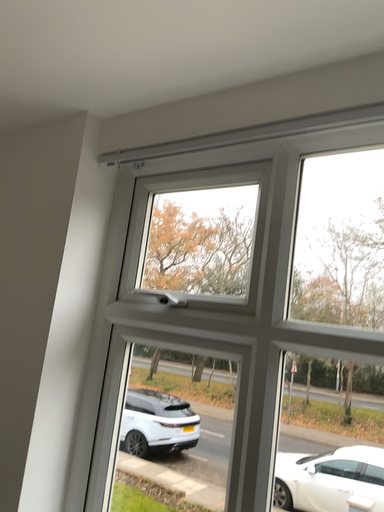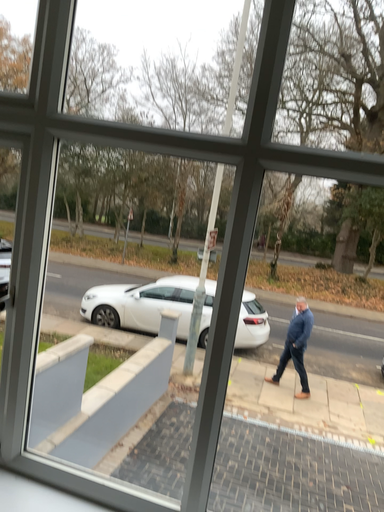
Question: How did the camera likely rotate when shooting the video?

Choices:
 (A) rotated upward
 (B) rotated downward

Answer: (B)